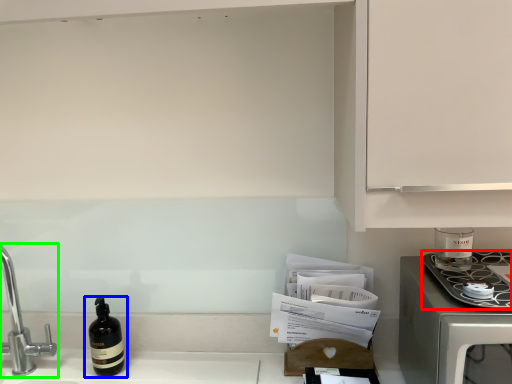
Question: Based on their relative distances, which object is nearer to kitchen appliance (highlighted by a red box)? Choose from bottle (highlighted by a blue box) and tap (highlighted by a green box).

Choices:
 (A) bottle
 (B) tap

Answer: (A)